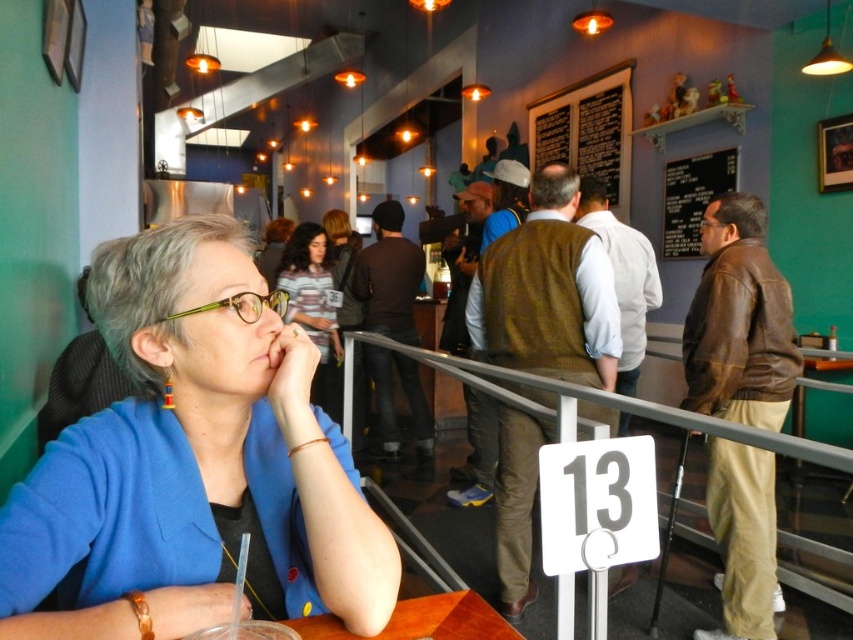
Between point (141, 273) and point (236, 294), which one is positioned behind?

The point (141, 273) is more distant.

Between point (173, 545) and point (280, 305), which one is positioned in front?

Point (173, 545)

Locate an element on the screen. This screenshot has height=640, width=853. blue fabric jacket at upper left is located at coordinates (193, 464).

Who is taller, metallic gray rail at center or black chalkboard at upper center?

With more height is black chalkboard at upper center.

Is point (485, 368) positioned before point (566, 115)?

Yes, it is.

Find the location of `metallic gray rail at center`. metallic gray rail at center is located at coordinates (590, 400).

Who is shorter, translucent plastic cup at lower center or yellow-green plastic glasses at center?

Standing shorter between the two is yellow-green plastic glasses at center.

Is point (505, 628) more distant than point (254, 321)?

No.

Locate an element on the screen. translucent plastic cup at lower center is located at coordinates (421, 620).

Identify the location of translucent plastic cup at lower center. Image resolution: width=853 pixels, height=640 pixels. [421, 620].